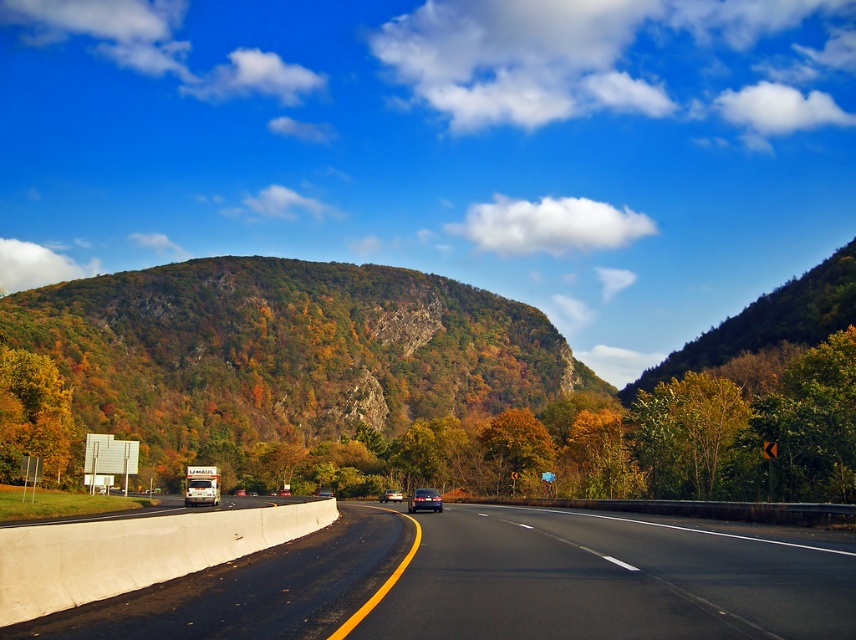
Which is below, smooth asphalt road at center or green matte tree at right?

green matte tree at right is below.

Is point (211, 602) positioned before point (712, 390)?

Yes, point (211, 602) is in front of point (712, 390).

I want to click on smooth asphalt road at center, so click(498, 582).

Between point (328, 300) and point (419, 508), which one is positioned behind?

The point (328, 300) is behind.

Does green leafy mountain at center have a smaller size compared to metallic blue sedan at center?

No, green leafy mountain at center is not smaller than metallic blue sedan at center.

This screenshot has height=640, width=856. What do you see at coordinates (284, 352) in the screenshot? I see `green leafy mountain at center` at bounding box center [284, 352].

You are a GUI agent. You are given a task and a screenshot of the screen. Output one action in this format:
    pyautogui.click(x=<x>, y=<y>)
    Task: Click on the green leafy mountain at center
    The width and height of the screenshot is (856, 640).
    Given the screenshot: What is the action you would take?
    (x=284, y=352)

In the scene shown: Which is more to the right, smooth asphalt road at center or metallic silver sedan at center?

Positioned to the right is smooth asphalt road at center.

Can you confirm if smooth asphalt road at center is bigger than metallic silver sedan at center?

Indeed, smooth asphalt road at center has a larger size compared to metallic silver sedan at center.

Who is more distant from viewer, (354, 524) or (399, 492)?

The point (399, 492) is behind.

Identify the location of smooth asphalt road at center. This screenshot has width=856, height=640. (498, 582).